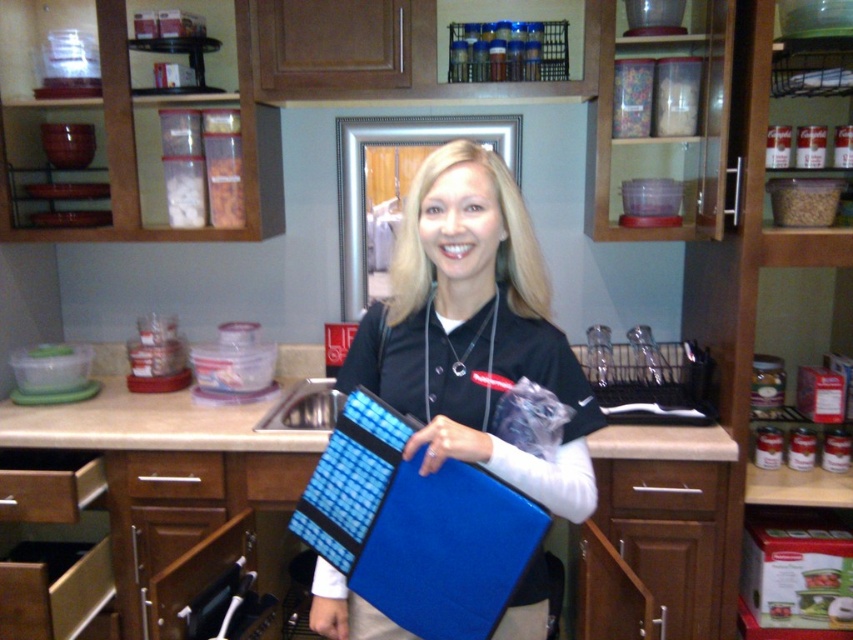
You are a customer in the kitchen and want to place the blue fabric folder at center and the brown wood drawer at center. Which one is to the left?

The blue fabric folder at center is positioned on the left side of brown wood drawer at center, so the blue fabric folder at center is more to the left.

In the scene shown: You are a customer in the kitchen and want to place a small item on the counter between the blue fabric folder at center and the brown wood drawer at center. Which object should you place it closer to so it doesn

The blue fabric folder at center is much taller than the brown wood drawer at center, so placing the item closer to the blue fabric folder at center would provide better visibility and accessibility.

Based on the photo, you are a kitchen assistant who needs to place a new set of utensils in the kitchen. You have two brown wood drawers available. The brown wood drawer at center and the brown wood drawer at lower left. According to the image, which drawer is positioned to the right of the other?

The brown wood drawer at center is to the right of brown wood drawer at lower left.